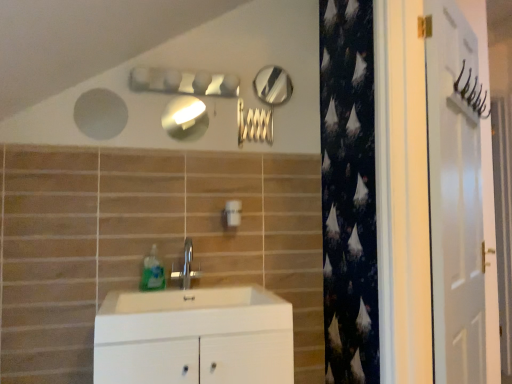
Question: From the image's perspective, is white plastic light switch at center beneath matte silver mirror at upper center, the second mirror when ordered from top to bottom?

Choices:
 (A) yes
 (B) no

Answer: (A)

Question: Is white plastic light switch at center next to matte silver mirror at upper center, the second mirror when ordered from top to bottom?

Choices:
 (A) no
 (B) yes

Answer: (A)

Question: Is white plastic light switch at center oriented away from matte silver mirror at upper center, positioned as the 1th mirror in front-to-back order?

Choices:
 (A) no
 (B) yes

Answer: (A)

Question: Considering the relative sizes of white plastic light switch at center and matte silver mirror at upper center, arranged as the second mirror when viewed from the right, in the image provided, is white plastic light switch at center thinner than matte silver mirror at upper center, arranged as the second mirror when viewed from the right,?

Choices:
 (A) no
 (B) yes

Answer: (A)

Question: Is white plastic light switch at center bigger than matte silver mirror at upper center, the 2th mirror from the back?

Choices:
 (A) yes
 (B) no

Answer: (A)

Question: From the image's perspective, is translucent plastic soap dispenser at sink above or below silver metallic faucet at center?

Choices:
 (A) below
 (B) above

Answer: (B)

Question: Does point (144, 271) appear closer or farther from the camera than point (179, 271)?

Choices:
 (A) farther
 (B) closer

Answer: (B)

Question: Considering the positions of translucent plastic soap dispenser at sink and silver metallic faucet at center in the image, is translucent plastic soap dispenser at sink wider or thinner than silver metallic faucet at center?

Choices:
 (A) wide
 (B) thin

Answer: (A)

Question: In the image, is translucent plastic soap dispenser at sink on the left side or the right side of silver metallic faucet at center?

Choices:
 (A) right
 (B) left

Answer: (B)

Question: Looking at the image, does white plastic light switch at center seem bigger or smaller compared to white matte cabinet at center?

Choices:
 (A) small
 (B) big

Answer: (A)

Question: From the image's perspective, is white plastic light switch at center positioned above or below white matte cabinet at center?

Choices:
 (A) above
 (B) below

Answer: (A)

Question: Is point (234, 203) positioned closer to the camera than point (164, 357)?

Choices:
 (A) closer
 (B) farther

Answer: (B)

Question: Choose the correct answer: Is white plastic light switch at center inside white matte cabinet at center or outside it?

Choices:
 (A) inside
 (B) outside

Answer: (B)

Question: Is polished silver mirror at upper center, which ranks as the 2th mirror in bottom-to-top order, spatially inside matte silver mirror at upper center, the 2th mirror from the back, or outside of it?

Choices:
 (A) inside
 (B) outside

Answer: (B)

Question: From a real-world perspective, is polished silver mirror at upper center, the first mirror in the back-to-front sequence, above or below matte silver mirror at upper center, the second mirror when ordered from top to bottom?

Choices:
 (A) below
 (B) above

Answer: (B)